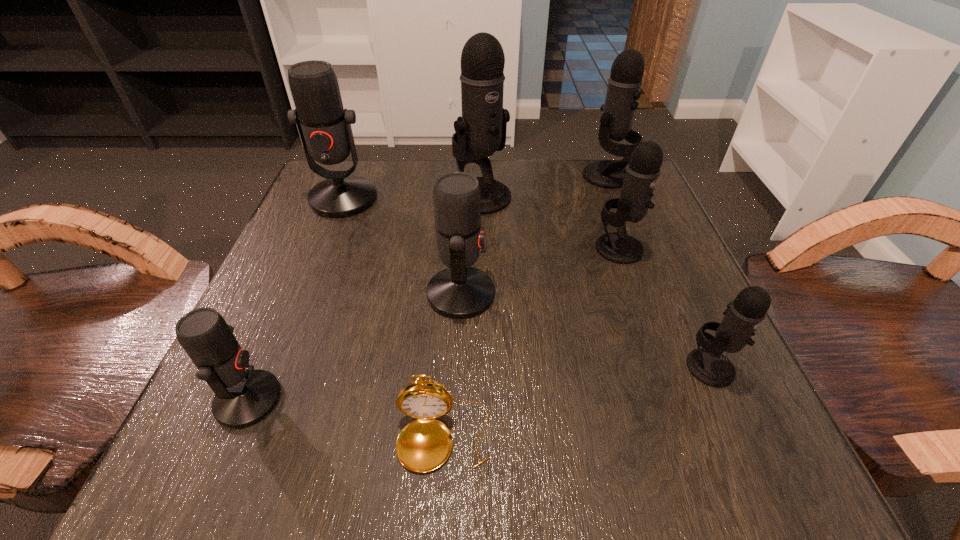
Identify the location of object situated at the far left corner. (324, 126).

Where is `object present at the near left corner`? The image size is (960, 540). object present at the near left corner is located at coordinates (243, 396).

Where is `object located in the far right corner section of the desktop`? The height and width of the screenshot is (540, 960). object located in the far right corner section of the desktop is located at coordinates (625, 81).

The image size is (960, 540). What are the coordinates of `free space at the far edge` in the screenshot? It's located at (548, 168).

Image resolution: width=960 pixels, height=540 pixels. In the image, there is a desktop. Identify the location of vacant space at the near edge. (387, 476).

This screenshot has height=540, width=960. I want to click on vacant space at the left edge of the desktop, so click(x=270, y=330).

Where is `blank space at the right edge of the desktop`? blank space at the right edge of the desktop is located at coordinates pyautogui.click(x=620, y=352).

The height and width of the screenshot is (540, 960). In order to click on vacant space at the near right corner of the desktop in this screenshot , I will do `click(703, 423)`.

Find the location of `free space between the leftmost black microphone and the farthest red microphone`. free space between the leftmost black microphone and the farthest red microphone is located at coordinates (412, 197).

This screenshot has height=540, width=960. I want to click on vacant point located between the tallest microphone and the second biggest black microphone, so click(x=543, y=186).